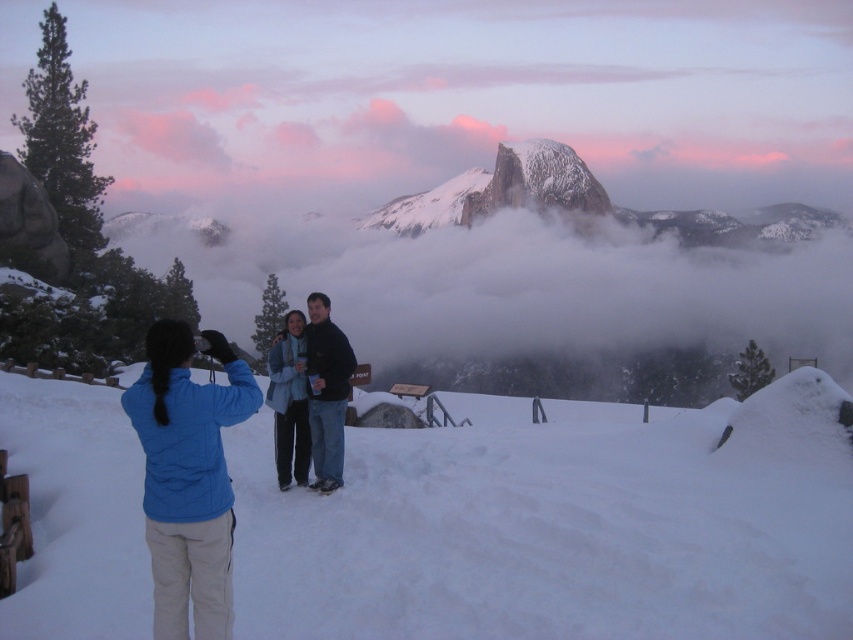
Between blue quilted jacket at lower left and snowy granite peak at center, which one is positioned lower?

Positioned lower is blue quilted jacket at lower left.

Measure the distance between blue quilted jacket at lower left and camera.

blue quilted jacket at lower left is 40.91 meters away from camera.

Is point (181, 397) in front of point (473, 209)?

Yes, it is in front of point (473, 209).

Find the location of `blue quilted jacket at lower left`. blue quilted jacket at lower left is located at coordinates (189, 477).

Can you confirm if white snow at lower left is taller than snowy granite peak at center?

In fact, white snow at lower left may be shorter than snowy granite peak at center.

Does point (743, 480) lie in front of point (535, 138)?

That is True.

Locate an element on the screen. This screenshot has height=640, width=853. white snow at lower left is located at coordinates (560, 524).

The height and width of the screenshot is (640, 853). Identify the location of white snow at lower left. (560, 524).

Is white snow at lower left bigger than blue quilted jacket at lower left?

Yes, white snow at lower left is bigger than blue quilted jacket at lower left.

Is white snow at lower left further to camera compared to blue quilted jacket at lower left?

That is True.

Between point (132, 515) and point (187, 493), which one is positioned behind?

The point (132, 515) is behind.

The height and width of the screenshot is (640, 853). What are the coordinates of `white snow at lower left` in the screenshot? It's located at (560, 524).